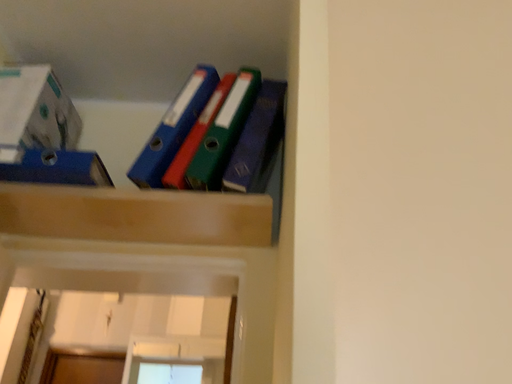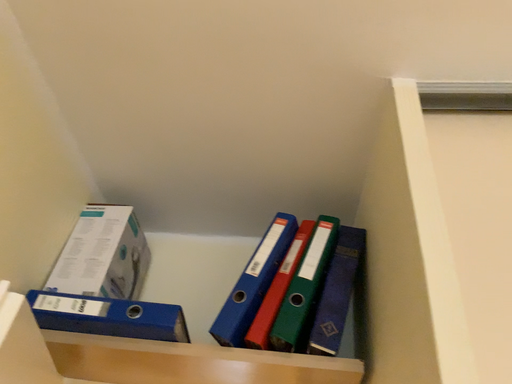
Question: How did the camera likely rotate when shooting the video?

Choices:
 (A) rotated downward
 (B) rotated upward

Answer: (B)